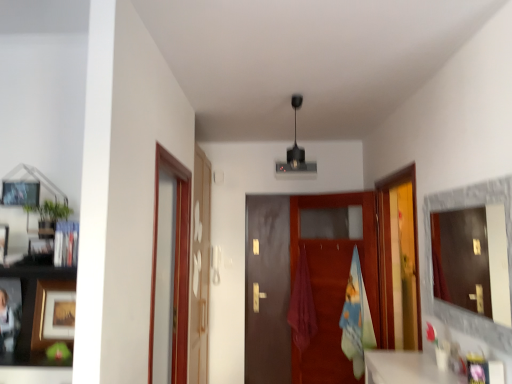
Question: From their relative heights in the image, would you say matte gray mirror at right is taller or shorter than brown matte door at center?

Choices:
 (A) short
 (B) tall

Answer: (A)

Question: From a real-world perspective, is matte gray mirror at right positioned above or below brown matte door at center?

Choices:
 (A) below
 (B) above

Answer: (B)

Question: Estimate the real-world distances between objects in this image. Which object is closer to the transparent glass door at right, which is the 3th glass door from left to right?

Choices:
 (A) transparent glass door at left, the 3th glass door from the right
 (B) matte pink towel at center
 (C) wooden picture frame at left, which is counted as the third picture frame, starting from the back
 (D) matte gray mirror at right
 (E) brown matte door at center

Answer: (E)

Question: Estimate the real-world distances between objects in this image. Which object is farther from the transparent glass door at left, the 2th glass door when ordered from left to right?

Choices:
 (A) matte pink towel at center
 (B) wooden picture frame at left, which is counted as the third picture frame, starting from the back
 (C) brown matte door at center
 (D) blue cotton bath towel at center
 (E) wooden matte picture frame at left, the 1th picture frame in the bottom-to-top sequence

Answer: (B)